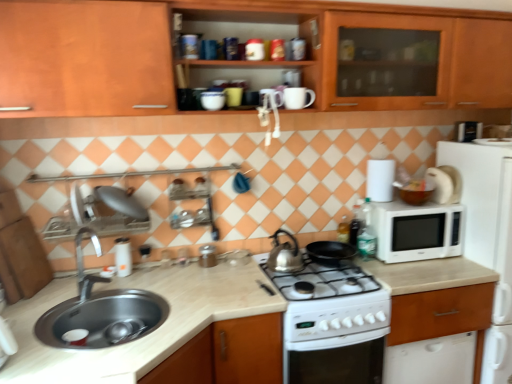
I want to click on vacant space positioned to the left of metallic silver canister at center, which is the 3th appliance from top to bottom, so click(173, 266).